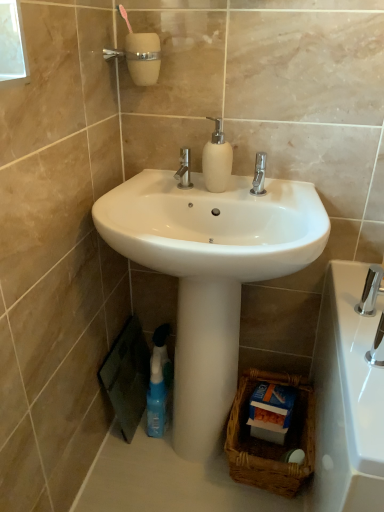
Question: Is polished chrome tap at lower right turned away from polished chrome faucet at lower right?

Choices:
 (A) no
 (B) yes

Answer: (A)

Question: From the image's perspective, does polished chrome tap at lower right appear lower than polished chrome faucet at lower right?

Choices:
 (A) no
 (B) yes

Answer: (A)

Question: Is the depth of polished chrome tap at lower right less than that of polished chrome faucet at lower right?

Choices:
 (A) no
 (B) yes

Answer: (A)

Question: From a real-world perspective, is polished chrome tap at lower right positioned under polished chrome faucet at lower right based on gravity?

Choices:
 (A) yes
 (B) no

Answer: (A)

Question: Is polished chrome tap at lower right not near polished chrome faucet at lower right?

Choices:
 (A) yes
 (B) no

Answer: (B)

Question: Does polished chrome tap at lower right have a greater width compared to polished chrome faucet at lower right?

Choices:
 (A) yes
 (B) no

Answer: (A)

Question: Is white glossy pedestal at center to the right of brown woven basket at lower right from the viewer's perspective?

Choices:
 (A) yes
 (B) no

Answer: (B)

Question: From a real-world perspective, is white glossy pedestal at center located beneath brown woven basket at lower right?

Choices:
 (A) no
 (B) yes

Answer: (A)

Question: Can you confirm if white glossy pedestal at center is thinner than brown woven basket at lower right?

Choices:
 (A) no
 (B) yes

Answer: (B)

Question: Does white glossy pedestal at center have a greater height compared to brown woven basket at lower right?

Choices:
 (A) no
 (B) yes

Answer: (B)

Question: Can you confirm if white glossy pedestal at center is smaller than brown woven basket at lower right?

Choices:
 (A) yes
 (B) no

Answer: (B)

Question: Is white glossy pedestal at center shorter than brown woven basket at lower right?

Choices:
 (A) no
 (B) yes

Answer: (A)

Question: Can you confirm if white glossy sink at center is bigger than white glossy pedestal at center?

Choices:
 (A) yes
 (B) no

Answer: (A)